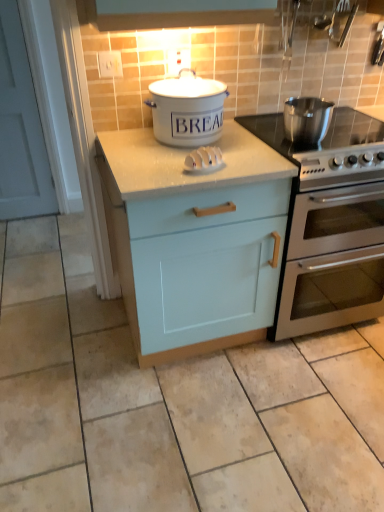
In order to click on empty space that is in between white ceramic bread bin at center, acting as the 1th kitchen appliance starting from the left, and white plastic knife block at center in this screenshot , I will do `click(201, 154)`.